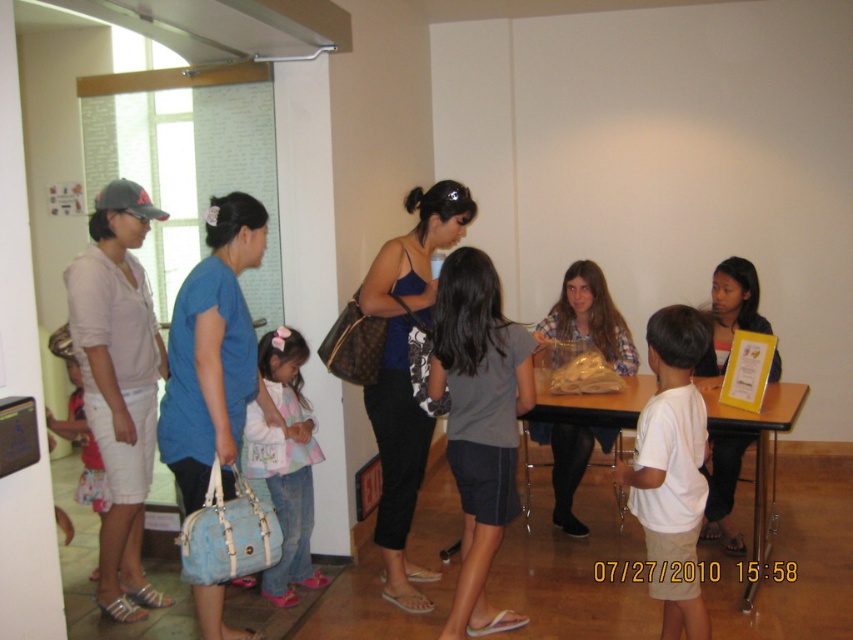
In the scene shown: You are a delivery person who needs to place a small package between the gray fabric shorts at center and the blue fabric purse at center. Can you fit the package in the space between them if the package is 29 inches long?

The gray fabric shorts at center and blue fabric purse at center are 28.99 inches apart. Since the package is 29 inches long, it is slightly longer than the available space. Therefore, the package cannot fit between them.

From the picture: You are standing in the room and want to move from the point at coordinates point (463, 328) to the point at coordinates point (281, 328). Is the destination point closer to the glass door with metal frame on the left side compared to your starting position?

Point (463, 328) is in front of point (281, 328), so the destination point at point (281, 328) is closer to the glass door with metal frame on the left side than the starting position.